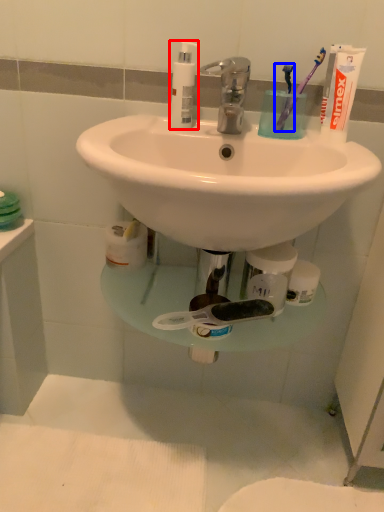
Question: Which point is closer to the camera, soap dispenser (highlighted by a red box) or toothbrush (highlighted by a blue box)?

Choices:
 (A) soap dispenser
 (B) toothbrush

Answer: (A)